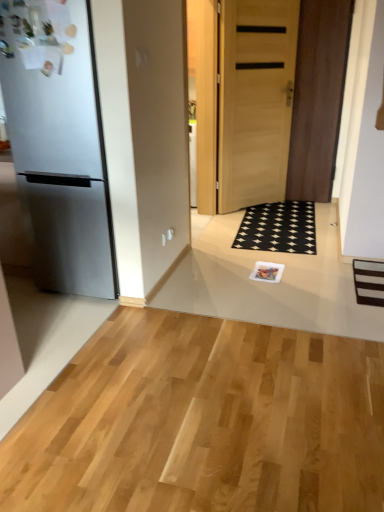
Locate an element on the screen. This screenshot has width=384, height=512. light brown wood door at center, which is the first door in left-to-right order is located at coordinates (255, 100).

Measure the distance between matte plastic magazine at center and camera.

matte plastic magazine at center and camera are 9.46 feet apart.

You are a GUI agent. You are given a task and a screenshot of the screen. Output one action in this format:
    pyautogui.click(x=<x>, y=<y>)
    Task: Click on the matte plastic magazine at center
    This screenshot has width=384, height=512.
    Given the screenshot: What is the action you would take?
    pyautogui.click(x=267, y=272)

In order to face black rubber doormat at center, should I rotate leftwards or rightwards?

To face it directly, rotate right by 11.479 degrees.

The image size is (384, 512). What do you see at coordinates (59, 152) in the screenshot?
I see `satin black refrigerator at left` at bounding box center [59, 152].

Locate an element on the screen. light brown wood door at center, acting as the second door starting from the right is located at coordinates (255, 100).

From the image's perspective, is black rubber doormat at center above light brown wood door at center, the 1th door positioned from the right?

Actually, black rubber doormat at center appears below light brown wood door at center, the 1th door positioned from the right, in the image.

Is point (273, 204) closer or farther from the camera than point (328, 106)?

Point (273, 204).

The height and width of the screenshot is (512, 384). Identify the location of doormat that is on the left side of light brown wood door at center, the 1th door positioned from the right. (278, 228).

Relative to black rubber doormat at center, is matte plastic magazine at center in front or behind?

matte plastic magazine at center is in front of black rubber doormat at center.

Considering the points (260, 261) and (295, 213), which point is in front, point (260, 261) or point (295, 213)?

Positioned in front is point (260, 261).

Considering the relative sizes of matte plastic magazine at center and black rubber doormat at center in the image provided, is matte plastic magazine at center smaller than black rubber doormat at center?

Yes, matte plastic magazine at center is smaller than black rubber doormat at center.

From the image's perspective, is matte plastic magazine at center beneath black rubber doormat at center?

Indeed, from the image's perspective, matte plastic magazine at center is shown beneath black rubber doormat at center.

Considering the sizes of black rubber doormat at center and satin black refrigerator at left in the image, is black rubber doormat at center taller or shorter than satin black refrigerator at left?

Clearly, black rubber doormat at center is shorter compared to satin black refrigerator at left.

Considering the sizes of black rubber doormat at center and satin black refrigerator at left in the image, is black rubber doormat at center bigger or smaller than satin black refrigerator at left?

Considering their sizes, black rubber doormat at center takes up less space than satin black refrigerator at left.

Is black rubber doormat at center to the right of satin black refrigerator at left from the viewer's perspective?

Correct, you'll find black rubber doormat at center to the right of satin black refrigerator at left.

From the image's perspective, does black rubber doormat at center appear higher than satin black refrigerator at left?

No, from the image's perspective, black rubber doormat at center is not above satin black refrigerator at left.

Do you think black rubber doormat at center is within light brown wood door at center, which is the first door in left-to-right order, or outside of it?

black rubber doormat at center lies outside light brown wood door at center, which is the first door in left-to-right order.

In terms of size, does black rubber doormat at center appear bigger or smaller than light brown wood door at center, acting as the second door starting from the right?

black rubber doormat at center is smaller than light brown wood door at center, acting as the second door starting from the right.

Does point (287, 206) lie in front of point (289, 68)?

That is False.

From a real-world perspective, which is physically below, black rubber doormat at center or light brown wood door at center, acting as the second door starting from the right?

black rubber doormat at center.

Does satin black refrigerator at left have a greater height compared to light brown wood door at center, which is the first door in left-to-right order?

No.

Are satin black refrigerator at left and light brown wood door at center, acting as the second door starting from the right, making contact?

No.

Based on the photo, how many degrees apart are the facing directions of satin black refrigerator at left and light brown wood door at center, acting as the second door starting from the right?

43.2 degrees separate the facing orientations of satin black refrigerator at left and light brown wood door at center, acting as the second door starting from the right.

Is satin black refrigerator at left facing towards light brown wood door at center, which is the first door in left-to-right order?

No, satin black refrigerator at left does not turn towards light brown wood door at center, which is the first door in left-to-right order.

Considering the relative sizes of matte plastic magazine at center and light brown wood door at center, the 1th door positioned from the right, in the image provided, is matte plastic magazine at center shorter than light brown wood door at center, the 1th door positioned from the right,?

Correct, matte plastic magazine at center is not as tall as light brown wood door at center, the 1th door positioned from the right.

Who is bigger, matte plastic magazine at center or light brown wood door at center, the 1th door positioned from the right?

light brown wood door at center, the 1th door positioned from the right, is bigger.

Can light brown wood door at center, positioned as the 2th door in left-to-right order, be found inside matte plastic magazine at center?

No, light brown wood door at center, positioned as the 2th door in left-to-right order, is not inside matte plastic magazine at center.

Considering the sizes of objects matte plastic magazine at center and light brown wood door at center, the 1th door positioned from the right, in the image provided, who is thinner, matte plastic magazine at center or light brown wood door at center, the 1th door positioned from the right,?

With smaller width is light brown wood door at center, the 1th door positioned from the right.

Considering the relative sizes of light brown wood door at center, positioned as the 2th door in left-to-right order, and satin black refrigerator at left in the image provided, is light brown wood door at center, positioned as the 2th door in left-to-right order, wider than satin black refrigerator at left?

In fact, light brown wood door at center, positioned as the 2th door in left-to-right order, might be narrower than satin black refrigerator at left.

Is light brown wood door at center, the 1th door positioned from the right, not near satin black refrigerator at left?

Indeed, light brown wood door at center, the 1th door positioned from the right, is not near satin black refrigerator at left.

Could you tell me if light brown wood door at center, the 1th door positioned from the right, is turned towards satin black refrigerator at left?

No, light brown wood door at center, the 1th door positioned from the right, is not aimed at satin black refrigerator at left.

This screenshot has height=512, width=384. Find the location of `door that is the 2nd one above the black rubber doormat at center (from a real-world perspective)`. door that is the 2nd one above the black rubber doormat at center (from a real-world perspective) is located at coordinates (318, 97).

I want to click on doormat behind the matte plastic magazine at center, so click(x=278, y=228).

Estimate the real-world distances between objects in this image. Which object is further from matte plastic magazine at center, black rubber doormat at center or light brown wood door at center, the 1th door positioned from the right?

Among the two, light brown wood door at center, the 1th door positioned from the right, is located further to matte plastic magazine at center.

From the picture: Considering their positions, is matte plastic magazine at center positioned closer to light brown wood door at center, the 1th door positioned from the right, than light brown wood door at center, acting as the second door starting from the right?

The object closer to light brown wood door at center, the 1th door positioned from the right, is light brown wood door at center, acting as the second door starting from the right.

Estimate the real-world distances between objects in this image. Which object is further from satin black refrigerator at left, light brown wood door at center, acting as the second door starting from the right, or light brown wood door at center, positioned as the 2th door in left-to-right order?

Based on the image, light brown wood door at center, positioned as the 2th door in left-to-right order, appears to be further to satin black refrigerator at left.

Which object lies nearer to the anchor point light brown wood door at center, positioned as the 2th door in left-to-right order, satin black refrigerator at left or matte plastic magazine at center?

matte plastic magazine at center is closer to light brown wood door at center, positioned as the 2th door in left-to-right order.

From the image, which object appears to be farther from matte plastic magazine at center, satin black refrigerator at left or light brown wood door at center, acting as the second door starting from the right?

Among the two, light brown wood door at center, acting as the second door starting from the right, is located further to matte plastic magazine at center.

Based on the photo, when comparing their distances from matte plastic magazine at center, does black rubber doormat at center or satin black refrigerator at left seem closer?

black rubber doormat at center lies closer to matte plastic magazine at center than the other object.

Which object lies further to the anchor point light brown wood door at center, acting as the second door starting from the right, matte plastic magazine at center or light brown wood door at center, the 1th door positioned from the right?

Based on the image, matte plastic magazine at center appears to be further to light brown wood door at center, acting as the second door starting from the right.

From the image, which object appears to be nearer to satin black refrigerator at left, black rubber doormat at center or light brown wood door at center, which is the first door in left-to-right order?

black rubber doormat at center is closer to satin black refrigerator at left.

Locate an element on the screen. This screenshot has width=384, height=512. door between satin black refrigerator at left and light brown wood door at center, the 1th door positioned from the right, in the front-back direction is located at coordinates (255, 100).

Image resolution: width=384 pixels, height=512 pixels. In order to click on magazine between satin black refrigerator at left and black rubber doormat at center in this screenshot , I will do `click(267, 272)`.

This screenshot has height=512, width=384. I want to click on doormat between light brown wood door at center, which is the first door in left-to-right order, and matte plastic magazine at center from top to bottom, so click(x=278, y=228).

Identify the location of doormat between satin black refrigerator at left and light brown wood door at center, acting as the second door starting from the right, along the z-axis. Image resolution: width=384 pixels, height=512 pixels. (278, 228).